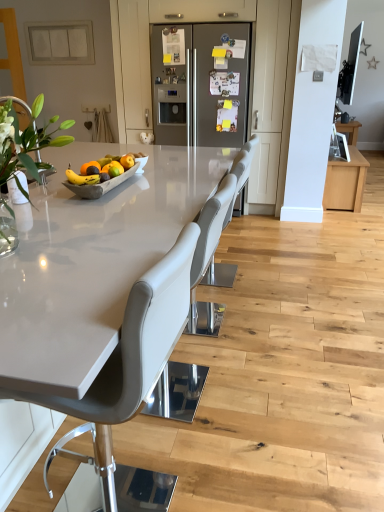
Question: Considering the positions of white glossy countertop at center and wooden tray at center in the image, is white glossy countertop at center wider or thinner than wooden tray at center?

Choices:
 (A) thin
 (B) wide

Answer: (B)

Question: Relative to wooden tray at center, is white glossy countertop at center in front or behind?

Choices:
 (A) behind
 (B) front

Answer: (B)

Question: Which of these objects is positioned farthest from the wooden tray at center?

Choices:
 (A) white glossy countertop at center
 (B) white matte switch plate at upper left, which ranks as the 2th cabinetry in right-to-left order
 (C) gray leather chair at center, the 2th chair in the front-to-back sequence
 (D) matte gray chair at center, which is the third chair in back-to-front order
 (E) shiny metallic tray at center

Answer: (B)

Question: Which object is the closest to the gray leather chair at center, the 2th chair in the front-to-back sequence?

Choices:
 (A) gray leather chair at center, which is the 3th chair in front-to-back order
 (B) shiny metallic tray at center
 (C) matte gray chair at center, placed as the first chair when sorted from front to back
 (D) wooden tray at center
 (E) orangesmoothfruit at center

Answer: (A)